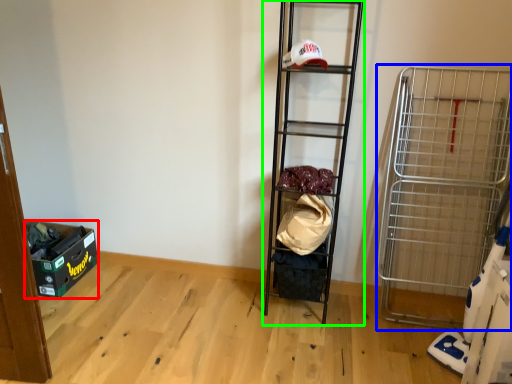
Question: Which object is positioned closest to storage box (highlighted by a red box)? Select from cart (highlighted by a blue box) and shelf (highlighted by a green box).

Choices:
 (A) cart
 (B) shelf

Answer: (B)